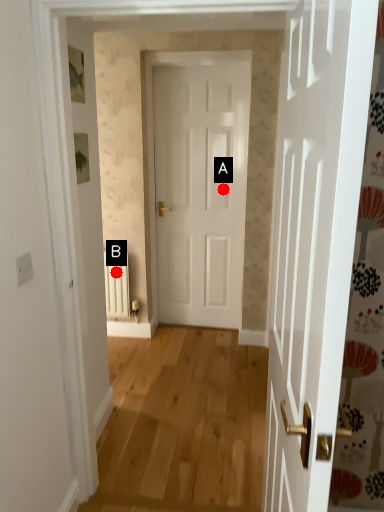
Question: Two points are circled on the image, labeled by A and B beside each circle. Which point is closer to the camera?

Choices:
 (A) A is closer
 (B) B is closer

Answer: (B)